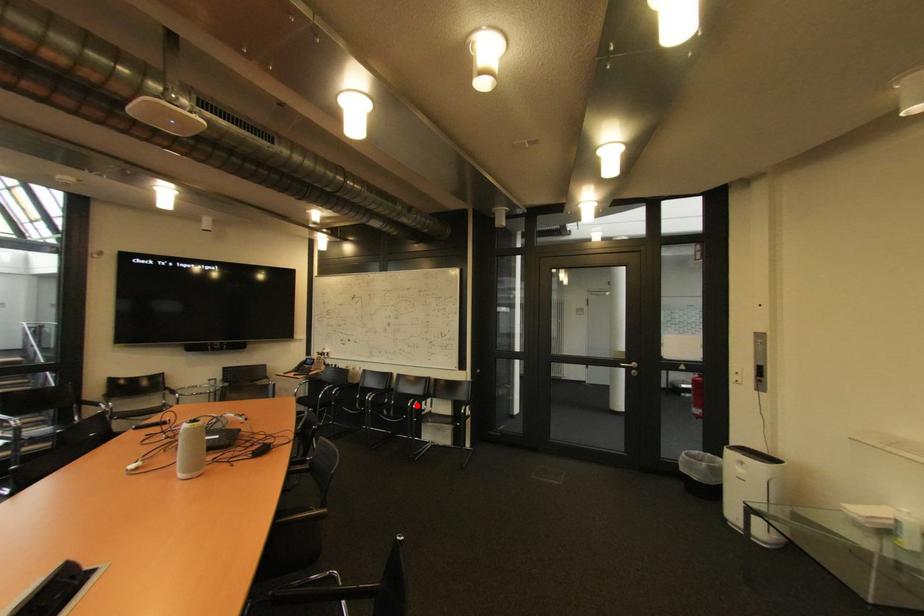
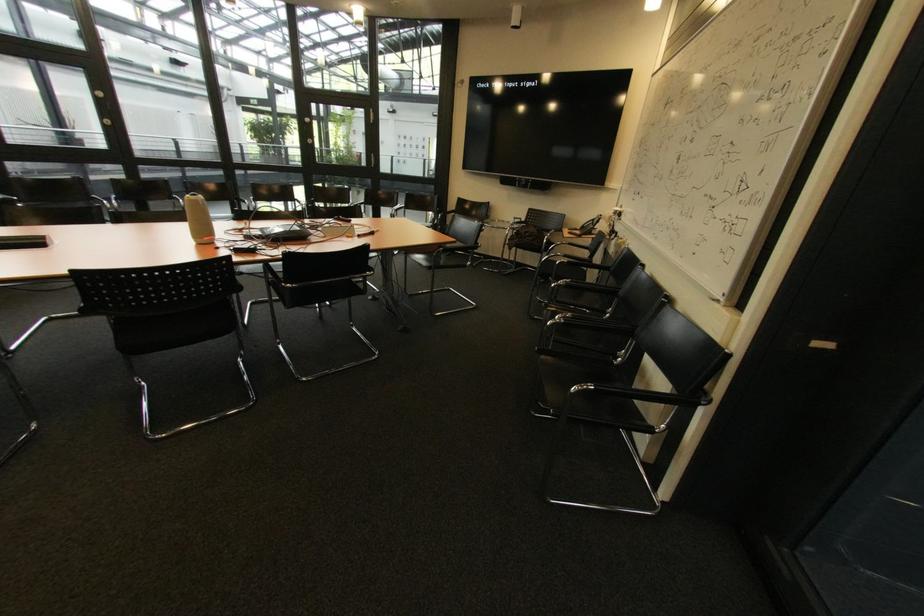
Question: I am providing you with two images of the same scene from different viewpoints. In image1, a red point is highlighted. Considering the same 3D point in image2, which of the following is correct?

Choices:
 (A) It is closer
 (B) It is farther

Answer: (A)